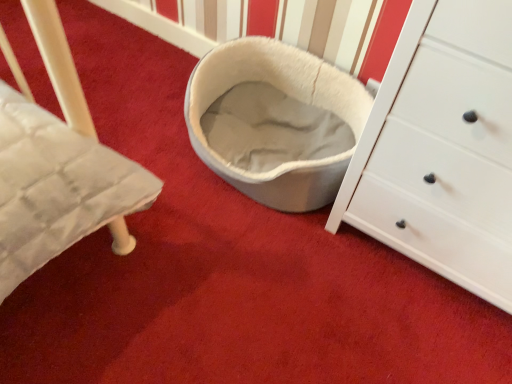
Question: Should I look upward or downward to see white soft pet bed at center?

Choices:
 (A) up
 (B) down

Answer: (A)